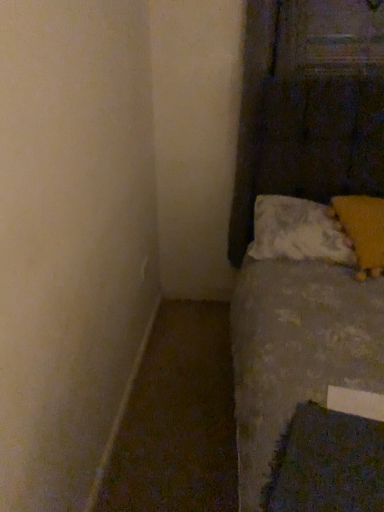
What do you see at coordinates (298, 231) in the screenshot? This screenshot has height=512, width=384. I see `white soft pillow at lower right, positioned as the first pillow in left-to-right order` at bounding box center [298, 231].

How much space does yellow fuzzy pillow at upper right, positioned as the first pillow in right-to-left order, occupy vertically?

yellow fuzzy pillow at upper right, positioned as the first pillow in right-to-left order, is 11.74 inches in height.

What do you see at coordinates (362, 230) in the screenshot? The height and width of the screenshot is (512, 384). I see `yellow fuzzy pillow at upper right, positioned as the first pillow in right-to-left order` at bounding box center [362, 230].

This screenshot has width=384, height=512. Find the location of `white soft pillow at lower right, positioned as the first pillow in left-to-right order`. white soft pillow at lower right, positioned as the first pillow in left-to-right order is located at coordinates (298, 231).

Considering the sizes of objects white soft pillow at lower right, which is the 2th pillow from right to left, and dark blue textured sheet at lower right in the image provided, who is shorter, white soft pillow at lower right, which is the 2th pillow from right to left, or dark blue textured sheet at lower right?

Standing shorter between the two is dark blue textured sheet at lower right.

Which object is thinner, white soft pillow at lower right, positioned as the first pillow in left-to-right order, or dark blue textured sheet at lower right?

dark blue textured sheet at lower right.

From the image's perspective, who appears lower, white soft pillow at lower right, positioned as the first pillow in left-to-right order, or dark blue textured sheet at lower right?

dark blue textured sheet at lower right is shown below in the image.

Is white soft pillow at lower right, positioned as the first pillow in left-to-right order, located outside dark blue textured sheet at lower right?

Absolutely, white soft pillow at lower right, positioned as the first pillow in left-to-right order, is external to dark blue textured sheet at lower right.

What's the angular difference between dark blue textured sheet at lower right and yellow fuzzy pillow at upper right, positioned as the first pillow in right-to-left order,'s facing directions?

dark blue textured sheet at lower right and yellow fuzzy pillow at upper right, positioned as the first pillow in right-to-left order, are facing 34.8 degrees away from each other.

Which is nearer, (348, 439) or (367, 199)?

Point (348, 439).

From their relative heights in the image, would you say dark blue textured sheet at lower right is taller or shorter than yellow fuzzy pillow at upper right, acting as the second pillow starting from the left?

Considering their sizes, dark blue textured sheet at lower right has less height than yellow fuzzy pillow at upper right, acting as the second pillow starting from the left.

Does dark blue textured sheet at lower right have a lesser height compared to white soft pillow at lower right, which is the 2th pillow from right to left?

Correct, dark blue textured sheet at lower right is not as tall as white soft pillow at lower right, which is the 2th pillow from right to left.

Which object is wider, dark blue textured sheet at lower right or white soft pillow at lower right, positioned as the first pillow in left-to-right order?

white soft pillow at lower right, positioned as the first pillow in left-to-right order.

Considering the sizes of objects dark blue textured sheet at lower right and white soft pillow at lower right, which is the 2th pillow from right to left, in the image provided, who is smaller, dark blue textured sheet at lower right or white soft pillow at lower right, which is the 2th pillow from right to left,?

dark blue textured sheet at lower right is smaller.

From a real-world perspective, between dark blue textured sheet at lower right and white soft pillow at lower right, which is the 2th pillow from right to left, who is vertically lower?

From a 3D spatial view, dark blue textured sheet at lower right is below.

Is yellow fuzzy pillow at upper right, acting as the second pillow starting from the left, smaller than white soft pillow at lower right, which is the 2th pillow from right to left?

Correct, yellow fuzzy pillow at upper right, acting as the second pillow starting from the left, occupies less space than white soft pillow at lower right, which is the 2th pillow from right to left.

Looking at this image, is yellow fuzzy pillow at upper right, positioned as the first pillow in right-to-left order, at the right side of white soft pillow at lower right, positioned as the first pillow in left-to-right order?

Indeed, yellow fuzzy pillow at upper right, positioned as the first pillow in right-to-left order, is positioned on the right side of white soft pillow at lower right, positioned as the first pillow in left-to-right order.

Can we say yellow fuzzy pillow at upper right, positioned as the first pillow in right-to-left order, lies outside white soft pillow at lower right, positioned as the first pillow in left-to-right order?

No, yellow fuzzy pillow at upper right, positioned as the first pillow in right-to-left order, is inside or overlapping with white soft pillow at lower right, positioned as the first pillow in left-to-right order.

Based on the photo, is white soft pillow at lower right, positioned as the first pillow in left-to-right order, positioned far away from yellow fuzzy pillow at upper right, positioned as the first pillow in right-to-left order?

white soft pillow at lower right, positioned as the first pillow in left-to-right order, is near yellow fuzzy pillow at upper right, positioned as the first pillow in right-to-left order, not far away.

Is white soft pillow at lower right, positioned as the first pillow in left-to-right order, positioned in front of yellow fuzzy pillow at upper right, acting as the second pillow starting from the left?

No, it is behind yellow fuzzy pillow at upper right, acting as the second pillow starting from the left.

Is white soft pillow at lower right, positioned as the first pillow in left-to-right order, oriented away from yellow fuzzy pillow at upper right, acting as the second pillow starting from the left?

Yes, yellow fuzzy pillow at upper right, acting as the second pillow starting from the left, is at the back of white soft pillow at lower right, positioned as the first pillow in left-to-right order.

This screenshot has width=384, height=512. Find the location of `pillow above the yellow fuzzy pillow at upper right, acting as the second pillow starting from the left (from the image's perspective)`. pillow above the yellow fuzzy pillow at upper right, acting as the second pillow starting from the left (from the image's perspective) is located at coordinates (298, 231).

From a real-world perspective, who is located higher, yellow fuzzy pillow at upper right, acting as the second pillow starting from the left, or dark blue textured sheet at lower right?

From a 3D spatial view, yellow fuzzy pillow at upper right, acting as the second pillow starting from the left, is above.

Considering the sizes of objects yellow fuzzy pillow at upper right, acting as the second pillow starting from the left, and dark blue textured sheet at lower right in the image provided, who is taller, yellow fuzzy pillow at upper right, acting as the second pillow starting from the left, or dark blue textured sheet at lower right?

yellow fuzzy pillow at upper right, acting as the second pillow starting from the left.

From the picture: From the image's perspective, which is above, yellow fuzzy pillow at upper right, positioned as the first pillow in right-to-left order, or dark blue textured sheet at lower right?

yellow fuzzy pillow at upper right, positioned as the first pillow in right-to-left order, appears higher in the image.

Identify the location of sheet located underneath the white soft pillow at lower right, positioned as the first pillow in left-to-right order (from a real-world perspective). (327, 464).

The image size is (384, 512). I want to click on the 1st pillow above when counting from the dark blue textured sheet at lower right (from the image's perspective), so click(362, 230).

Looking at the image, which one is located closer to white soft pillow at lower right, which is the 2th pillow from right to left, yellow fuzzy pillow at upper right, positioned as the first pillow in right-to-left order, or dark blue textured sheet at lower right?

yellow fuzzy pillow at upper right, positioned as the first pillow in right-to-left order, lies closer to white soft pillow at lower right, which is the 2th pillow from right to left, than the other object.

Looking at the image, which one is located closer to yellow fuzzy pillow at upper right, positioned as the first pillow in right-to-left order, white soft pillow at lower right, positioned as the first pillow in left-to-right order, or dark blue textured sheet at lower right?

white soft pillow at lower right, positioned as the first pillow in left-to-right order, is closer to yellow fuzzy pillow at upper right, positioned as the first pillow in right-to-left order.

Looking at the image, which one is located further to dark blue textured sheet at lower right, yellow fuzzy pillow at upper right, acting as the second pillow starting from the left, or white soft pillow at lower right, positioned as the first pillow in left-to-right order?

The object further to dark blue textured sheet at lower right is white soft pillow at lower right, positioned as the first pillow in left-to-right order.

Estimate the real-world distances between objects in this image. Which object is closer to yellow fuzzy pillow at upper right, acting as the second pillow starting from the left, dark blue textured sheet at lower right or white soft pillow at lower right, which is the 2th pillow from right to left?

Based on the image, white soft pillow at lower right, which is the 2th pillow from right to left, appears to be nearer to yellow fuzzy pillow at upper right, acting as the second pillow starting from the left.

Looking at the image, which one is located further to white soft pillow at lower right, which is the 2th pillow from right to left, dark blue textured sheet at lower right or yellow fuzzy pillow at upper right, acting as the second pillow starting from the left?

Among the two, dark blue textured sheet at lower right is located further to white soft pillow at lower right, which is the 2th pillow from right to left.

Looking at this image, looking at the image, which one is located further to dark blue textured sheet at lower right, white soft pillow at lower right, which is the 2th pillow from right to left, or yellow fuzzy pillow at upper right, positioned as the first pillow in right-to-left order?

Among the two, white soft pillow at lower right, which is the 2th pillow from right to left, is located further to dark blue textured sheet at lower right.

Where is `pillow between dark blue textured sheet at lower right and white soft pillow at lower right, positioned as the first pillow in left-to-right order, in the front-back direction`? The width and height of the screenshot is (384, 512). pillow between dark blue textured sheet at lower right and white soft pillow at lower right, positioned as the first pillow in left-to-right order, in the front-back direction is located at coordinates (362, 230).